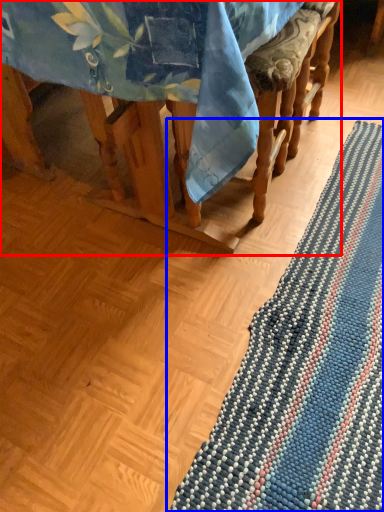
Question: Among these objects, which one is farthest to the camera, furniture (highlighted by a red box) or mat (highlighted by a blue box)?

Choices:
 (A) furniture
 (B) mat

Answer: (B)